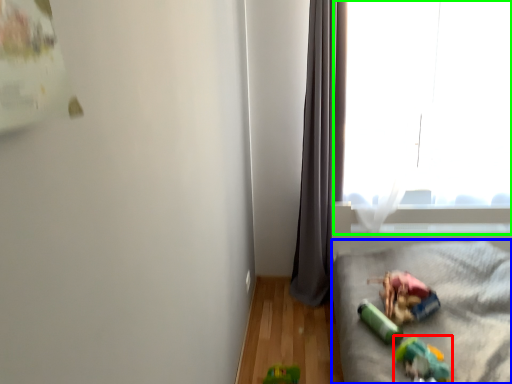
Question: Estimate the real-world distances between objects in this image. Which object is closer to toy (highlighted by a red box), furniture (highlighted by a blue box) or window (highlighted by a green box)?

Choices:
 (A) furniture
 (B) window

Answer: (A)